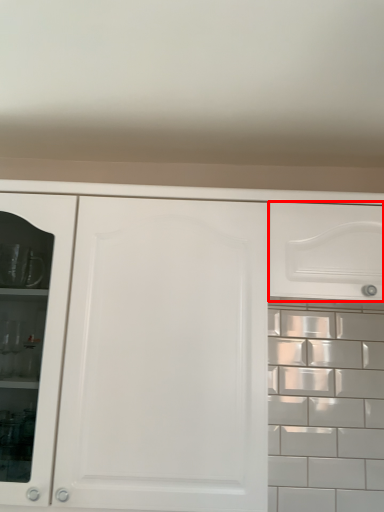
Question: From the image's perspective, where is drawer (annotated by the red box) located relative to cabinetry?

Choices:
 (A) below
 (B) above

Answer: (B)